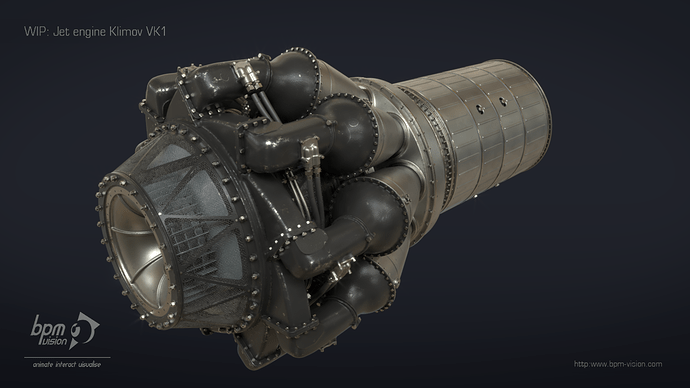
You are a GUI agent. You are given a task and a screenshot of the screen. Output one action in this format:
    pyautogui.click(x=<x>, y=<y>)
    Task: Click on the fan
    This screenshot has width=690, height=388.
    Given the screenshot: What is the action you would take?
    pyautogui.click(x=184, y=237)